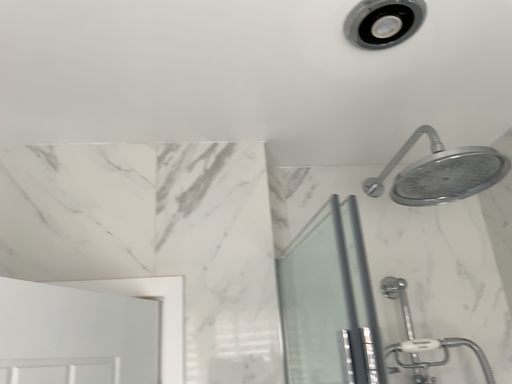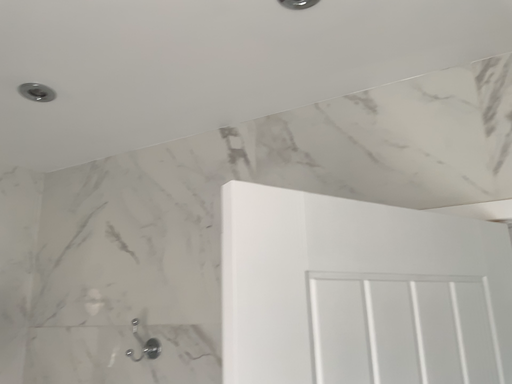
Question: Which way did the camera rotate in the video?

Choices:
 (A) rotated right
 (B) rotated left

Answer: (B)